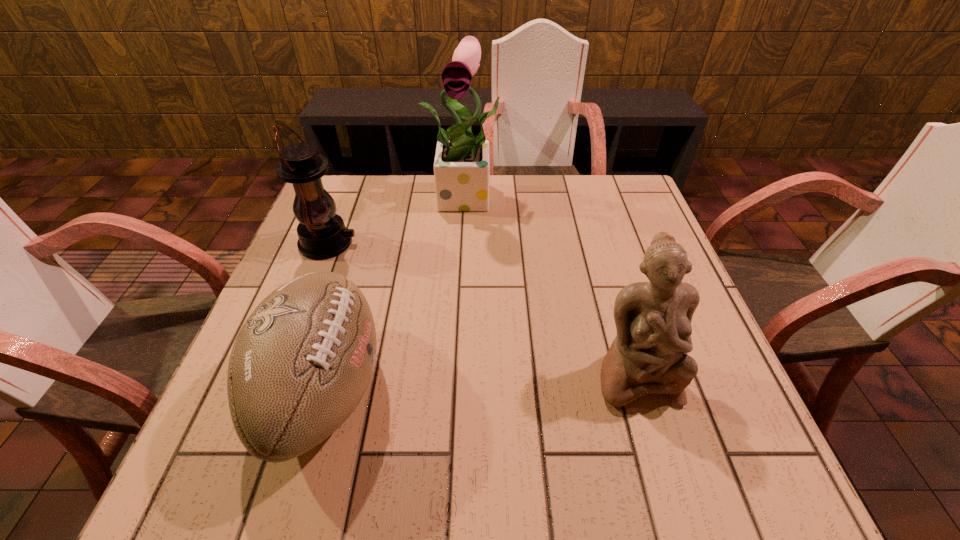
Where is `free location at the near left corner of the desktop`? The width and height of the screenshot is (960, 540). free location at the near left corner of the desktop is located at coordinates (209, 448).

You are a GUI agent. You are given a task and a screenshot of the screen. Output one action in this format:
    pyautogui.click(x=<x>, y=<y>)
    Task: Click on the free space at the far right corner of the desktop
    The height and width of the screenshot is (540, 960).
    Given the screenshot: What is the action you would take?
    pyautogui.click(x=642, y=212)

At what (x,y) coordinates should I click in order to perform the action: click on free space that is in between the farthest object and the figurine. Please return your answer as a coordinate pair (x, y). This screenshot has width=960, height=540. Looking at the image, I should click on (552, 285).

The height and width of the screenshot is (540, 960). In order to click on free spot between the figurine and the third nearest object in this screenshot , I will do `click(481, 308)`.

Locate an element on the screen. free space between the lantern and the farthest object is located at coordinates (398, 220).

Image resolution: width=960 pixels, height=540 pixels. I want to click on free space between the football (American) and the rightmost object, so click(x=479, y=382).

This screenshot has width=960, height=540. I want to click on free space between the flower arrangement and the rightmost object, so click(552, 285).

The image size is (960, 540). I want to click on free spot between the tallest object and the figurine, so click(x=552, y=285).

Find the location of a particular element. vacant area between the tallest object and the rightmost object is located at coordinates (552, 285).

This screenshot has height=540, width=960. I want to click on free spot between the figurine and the shortest object, so click(479, 382).